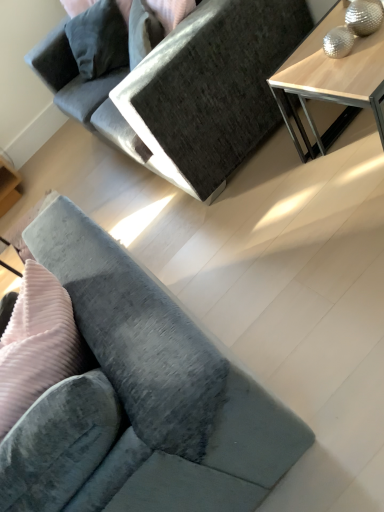
Locate an element on the screen. This screenshot has height=512, width=384. blank area beneath light wood table at upper right (from a real-world perspective) is located at coordinates (356, 142).